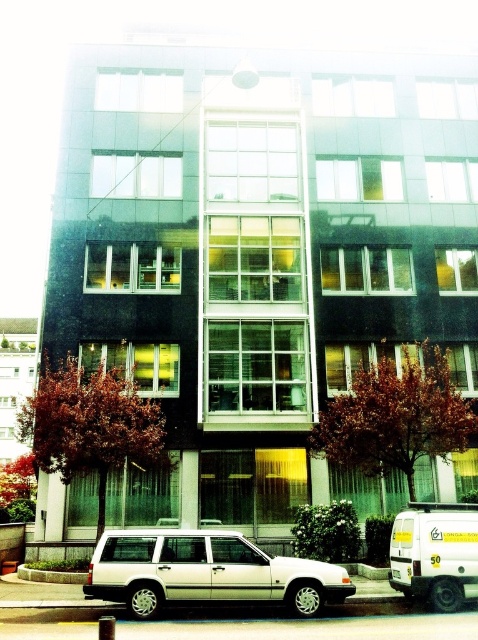
You are a delivery driver who needs to park your white matte van at lower right in a space that can only accommodate vehicles up to 5 meters in length. Given that the silver metallic station wagon at lower center is parked nearby, can you determine if your van will fit in the space?

The silver metallic station wagon at lower center is shorter than the white matte van at lower right. Since the van is longer than the station wagon, and the parking space can only accommodate up to 5 meters, you need to measure the van to confirm if it exceeds the limit. However, without knowing the exact length of the station wagon, we cannot determine if the van will fit.

You are a delivery person who needs to park your white matte van at lower right. There is a silver metallic station wagon at lower center blocking your path. Can you drive around it to the right side?

The silver metallic station wagon at lower center is to the left of the white matte van at lower right, so you can drive around it to the right side.

You are standing at the entrance of the building and want to park your car at the point marked by the coordinates point [206,572]. Is there already a vehicle parked at that location?

Yes, the point [206,572] is on the silver metallic station wagon at lower center, so there is already a vehicle parked there.